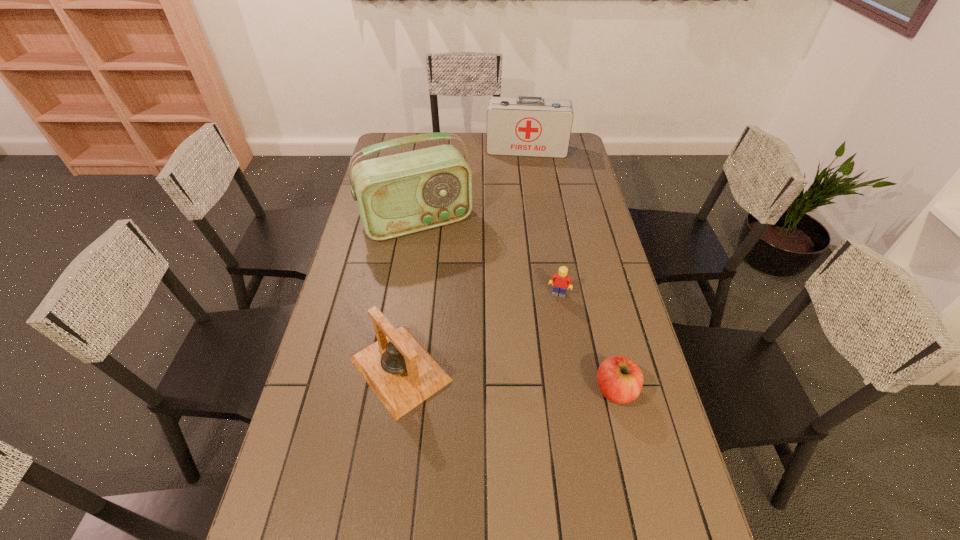
Identify the location of free point between the second farthest object and the bell. (409, 295).

You are a GUI agent. You are given a task and a screenshot of the screen. Output one action in this format:
    pyautogui.click(x=<x>, y=<y>)
    Task: Click on the free space between the third shortest object and the radio receiver
    
    Given the screenshot: What is the action you would take?
    pos(409,295)

Identify the location of free space between the tallest object and the apple. This screenshot has height=540, width=960. (516, 306).

Find the location of `vacant area that lies between the Lego and the apple`. vacant area that lies between the Lego and the apple is located at coordinates (588, 342).

Image resolution: width=960 pixels, height=540 pixels. I want to click on vacant region between the apple and the first-aid kit, so click(x=571, y=270).

Image resolution: width=960 pixels, height=540 pixels. In order to click on free point between the fourth shortest object and the apple in this screenshot , I will do `click(571, 270)`.

This screenshot has height=540, width=960. I want to click on free space between the farthest object and the third farthest object, so click(x=542, y=222).

Choose which object is the third nearest neighbor to the farthest object. Please provide its 2D coordinates. Your answer should be formatted as a tuple, i.e. [(x, y)], where the tuple contains the x and y coordinates of a point satisfying the conditions above.

[(402, 374)]

At what (x,y) coordinates should I click in order to perform the action: click on object that is the fourth nearest to the apple. Please return your answer as a coordinate pair (x, y). The width and height of the screenshot is (960, 540). Looking at the image, I should click on tap(526, 126).

Where is `blank space that satisfies the following two spatial constraints: 1. on the back side of the bell; 2. on the left side of the first-aid kit`? The image size is (960, 540). blank space that satisfies the following two spatial constraints: 1. on the back side of the bell; 2. on the left side of the first-aid kit is located at coordinates (432, 150).